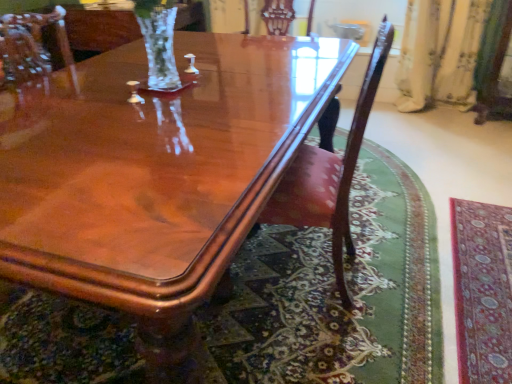
Question: From a real-world perspective, does carpet with intricate patterns at lower right sit lower than mahogany wood chair at center?

Choices:
 (A) no
 (B) yes

Answer: (B)

Question: Is carpet with intricate patterns at lower right touching mahogany wood chair at center?

Choices:
 (A) yes
 (B) no

Answer: (B)

Question: From the image's perspective, would you say carpet with intricate patterns at lower right is shown under mahogany wood chair at center?

Choices:
 (A) yes
 (B) no

Answer: (A)

Question: Considering the relative sizes of carpet with intricate patterns at lower right and mahogany wood chair at center in the image provided, is carpet with intricate patterns at lower right thinner than mahogany wood chair at center?

Choices:
 (A) no
 (B) yes

Answer: (B)

Question: Are carpet with intricate patterns at lower right and mahogany wood chair at center located far from each other?

Choices:
 (A) yes
 (B) no

Answer: (B)

Question: Is carpet with intricate patterns at lower right at the left side of mahogany wood chair at center?

Choices:
 (A) yes
 (B) no

Answer: (B)

Question: Can you confirm if carpet with intricate patterns at lower right is thinner than glossy wood coffee table at center?

Choices:
 (A) no
 (B) yes

Answer: (B)

Question: Is carpet with intricate patterns at lower right located outside glossy wood coffee table at center?

Choices:
 (A) yes
 (B) no

Answer: (A)

Question: Does carpet with intricate patterns at lower right appear on the right side of glossy wood coffee table at center?

Choices:
 (A) no
 (B) yes

Answer: (B)

Question: From the image's perspective, is carpet with intricate patterns at lower right on top of glossy wood coffee table at center?

Choices:
 (A) no
 (B) yes

Answer: (A)

Question: Can you confirm if carpet with intricate patterns at lower right is smaller than glossy wood coffee table at center?

Choices:
 (A) yes
 (B) no

Answer: (A)

Question: Is carpet with intricate patterns at lower right shorter than glossy wood coffee table at center?

Choices:
 (A) yes
 (B) no

Answer: (A)

Question: Considering the relative sizes of mahogany wood chair at center and glossy wood coffee table at center in the image provided, is mahogany wood chair at center bigger than glossy wood coffee table at center?

Choices:
 (A) yes
 (B) no

Answer: (B)